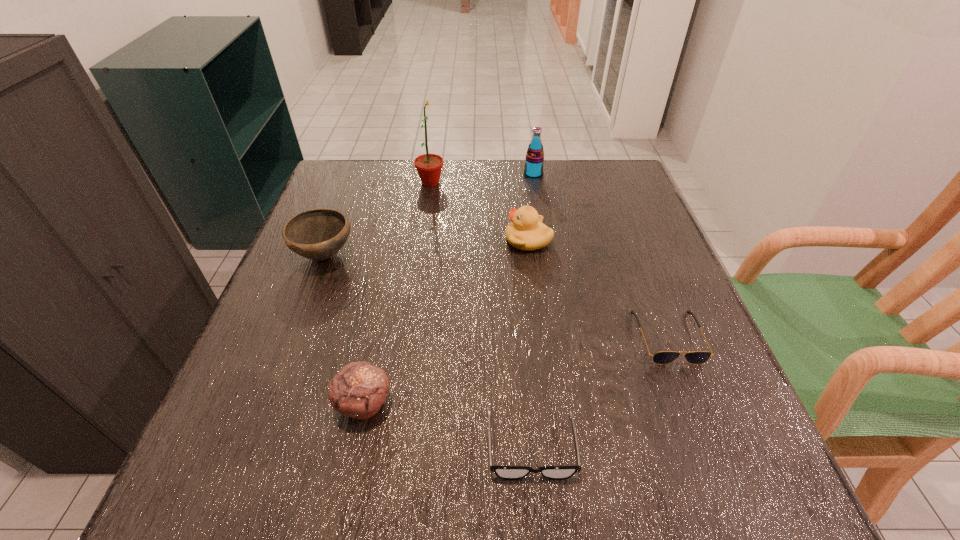
At what (x,y) coordinates should I click in order to perform the action: click on sunflower. Please return your answer as a coordinate pair (x, y). Image resolution: width=960 pixels, height=540 pixels. Looking at the image, I should click on (429, 166).

Locate an element on the screen. soda is located at coordinates (533, 167).

Image resolution: width=960 pixels, height=540 pixels. Identify the location of duckling. (526, 232).

Where is `bowl`? bowl is located at coordinates (318, 234).

The width and height of the screenshot is (960, 540). What are the coordinates of `muffin` in the screenshot? It's located at (358, 390).

Where is `the rightmost object`? This screenshot has width=960, height=540. the rightmost object is located at coordinates (663, 357).

Identify the location of sunglasses. (663, 357).

Locate an element on the screen. spectacles is located at coordinates (504, 472).

This screenshot has height=540, width=960. I want to click on free spot located 0.230m on the face of the tallest object, so click(529, 183).

Image resolution: width=960 pixels, height=540 pixels. I want to click on free region located on the left of the soda, so click(x=488, y=174).